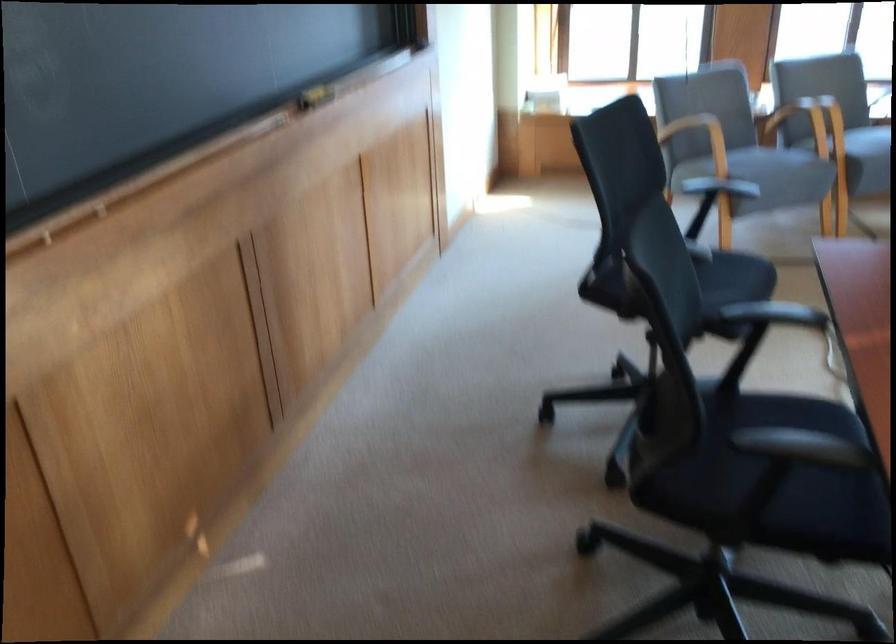
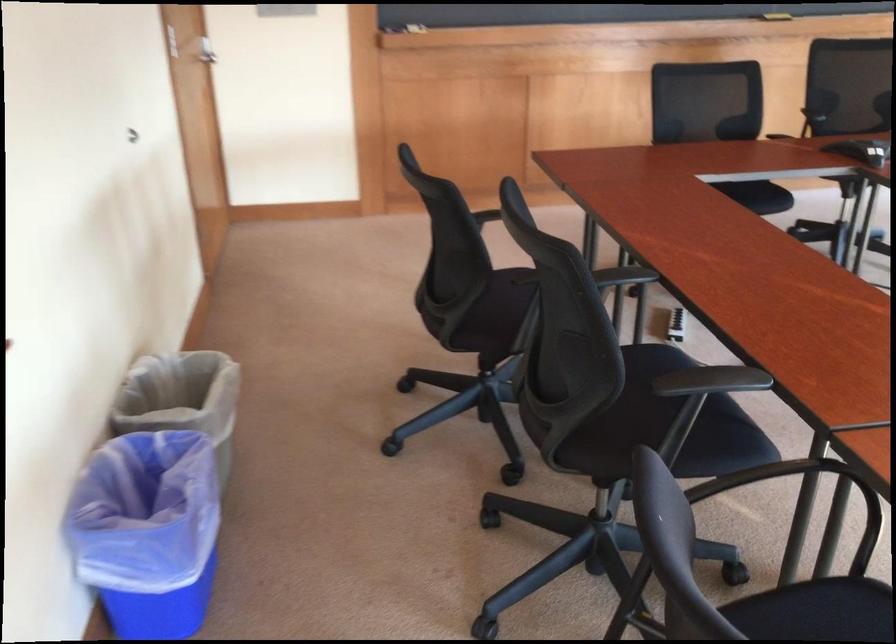
Question: I am providing you with two images of the same scene from different viewpoints. Please identify which objects are invisible in image2.

Choices:
 (A) blue trash can
 (B) black chair sitting surface
 (C) round brown onion
 (D) black chair armrest

Answer: (B)